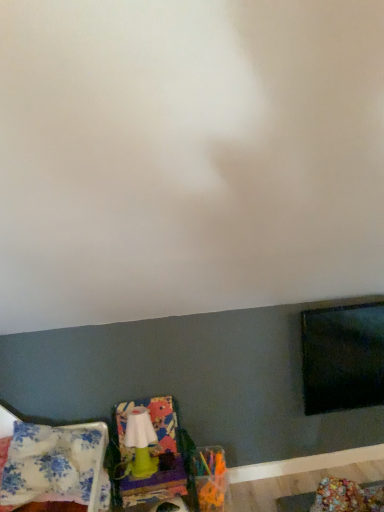
Question: From the image's perspective, is green plastic swivel chair at lower left below floral fabric pillow at lower left?

Choices:
 (A) no
 (B) yes

Answer: (B)

Question: Is green plastic swivel chair at lower left turned away from floral fabric pillow at lower left?

Choices:
 (A) yes
 (B) no

Answer: (B)

Question: From a real-world perspective, is green plastic swivel chair at lower left beneath floral fabric pillow at lower left?

Choices:
 (A) no
 (B) yes

Answer: (B)

Question: Is green plastic swivel chair at lower left not close to floral fabric pillow at lower left?

Choices:
 (A) yes
 (B) no

Answer: (B)

Question: Is green plastic swivel chair at lower left outside floral fabric pillow at lower left?

Choices:
 (A) no
 (B) yes

Answer: (B)

Question: Is floral fabric pillow at lower left inside the boundaries of green matte lamp at lower left, or outside?

Choices:
 (A) outside
 (B) inside

Answer: (A)

Question: Would you say floral fabric pillow at lower left is to the left or to the right of green matte lamp at lower left in the picture?

Choices:
 (A) left
 (B) right

Answer: (A)

Question: In the image, is floral fabric pillow at lower left positioned in front of or behind green matte lamp at lower left?

Choices:
 (A) behind
 (B) front

Answer: (B)

Question: Based on their sizes in the image, would you say floral fabric pillow at lower left is bigger or smaller than green matte lamp at lower left?

Choices:
 (A) small
 (B) big

Answer: (B)

Question: Considering the positions of floral fabric pillow at lower left and green plastic swivel chair at lower left in the image, is floral fabric pillow at lower left wider or thinner than green plastic swivel chair at lower left?

Choices:
 (A) thin
 (B) wide

Answer: (B)

Question: Is floral fabric pillow at lower left taller or shorter than green plastic swivel chair at lower left?

Choices:
 (A) short
 (B) tall

Answer: (A)

Question: From the image's perspective, is floral fabric pillow at lower left located above or below green plastic swivel chair at lower left?

Choices:
 (A) above
 (B) below

Answer: (A)

Question: Based on their positions, is floral fabric pillow at lower left located to the left or right of green plastic swivel chair at lower left?

Choices:
 (A) left
 (B) right

Answer: (A)

Question: Considering the positions of green plastic swivel chair at lower left and floral fabric pillow at lower left in the image, is green plastic swivel chair at lower left wider or thinner than floral fabric pillow at lower left?

Choices:
 (A) wide
 (B) thin

Answer: (B)

Question: Considering the positions of green plastic swivel chair at lower left and floral fabric pillow at lower left in the image, is green plastic swivel chair at lower left bigger or smaller than floral fabric pillow at lower left?

Choices:
 (A) small
 (B) big

Answer: (B)